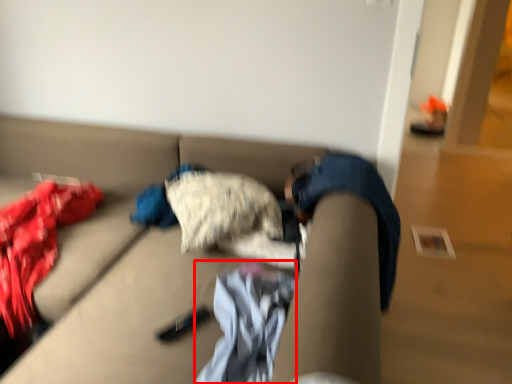
Question: Considering the relative positions of baby clothe (annotated by the red box) and studio couch in the image provided, where is baby clothe (annotated by the red box) located with respect to the staircase?

Choices:
 (A) left
 (B) right

Answer: (B)